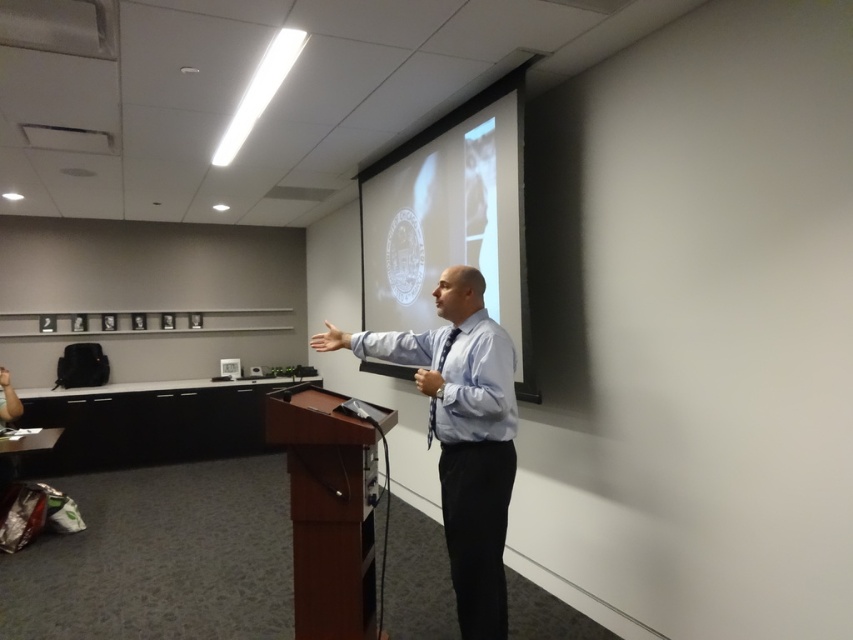
You are standing in the conference room and see two points marked on the wall. The first point is at coordinates point (495,332) and the second is at point (354,476). If you want to place a new poster closer to you, which point should you choose?

Point (495,332) is closer to the viewer than point (354,476), so you should choose point (495,332) to place the new poster closer to you.

You are organizing a presentation and need to ensure that the white glossy projection screen at upper center and the brown wood podium at center are appropriately sized for the room. Based on the description, which object is larger?

The white glossy projection screen at upper center is bigger than the brown wood podium at center.

You are a photographer in the back of the room. You want to take a photo of the blue shirt at center so it is not blocked by the white glossy projection screen at upper center. What should you do?

The blue shirt at center is behind the white glossy projection screen at upper center, so you should move closer to the front of the room to ensure the blue shirt at center is visible and not blocked by the screen.